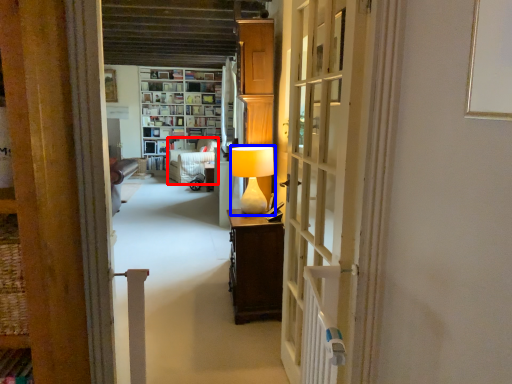
Question: Which of the following is the farthest to the observer, armchair (highlighted by a red box) or table lamp (highlighted by a blue box)?

Choices:
 (A) armchair
 (B) table lamp

Answer: (A)